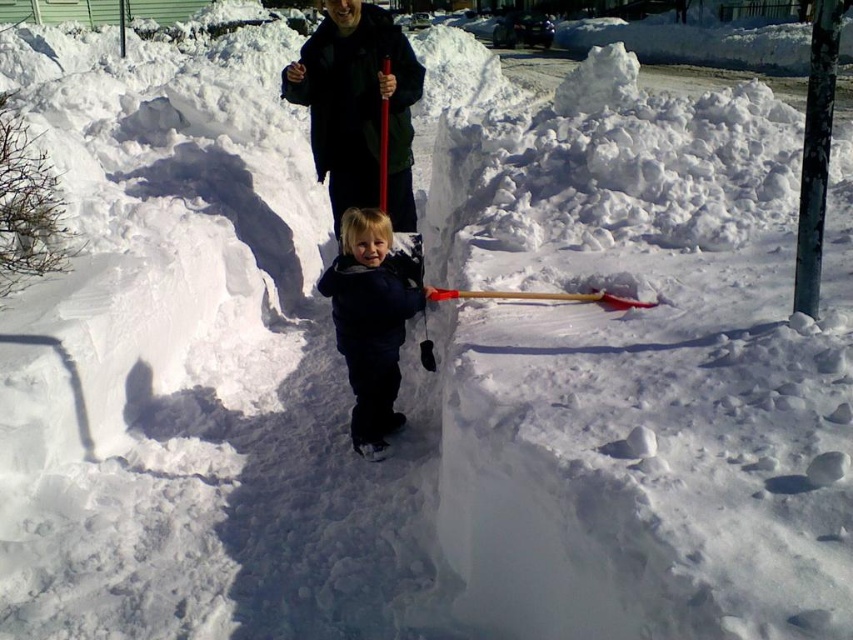
Is dark blue jacket at center thinner than wooden shovel at center?

Yes.

Can you confirm if dark blue jacket at center is positioned to the left of wooden shovel at center?

Indeed, dark blue jacket at center is positioned on the left side of wooden shovel at center.

Describe the element at coordinates (358, 106) in the screenshot. I see `dark blue jacket at center` at that location.

You are a GUI agent. You are given a task and a screenshot of the screen. Output one action in this format:
    pyautogui.click(x=<x>, y=<y>)
    Task: Click on the dark blue jacket at center
    This screenshot has height=640, width=853.
    Given the screenshot: What is the action you would take?
    pyautogui.click(x=358, y=106)

Where is `dark blue fleece jacket at center`? The image size is (853, 640). dark blue fleece jacket at center is located at coordinates (372, 320).

Between dark blue fleece jacket at center and wooden shovel at center, which one is positioned lower?

dark blue fleece jacket at center is below.

Which is behind, point (386, 376) or point (630, 300)?

The point (386, 376) is more distant.

This screenshot has height=640, width=853. Find the location of `dark blue fleece jacket at center`. dark blue fleece jacket at center is located at coordinates (372, 320).

Looking at this image, can you confirm if smooth gray pole at upper right is shorter than wooden shovel at center?

No, smooth gray pole at upper right is not shorter than wooden shovel at center.

Who is more distant from viewer, [802,282] or [473,294]?

The point [473,294] is behind.

The width and height of the screenshot is (853, 640). I want to click on smooth gray pole at upper right, so click(815, 154).